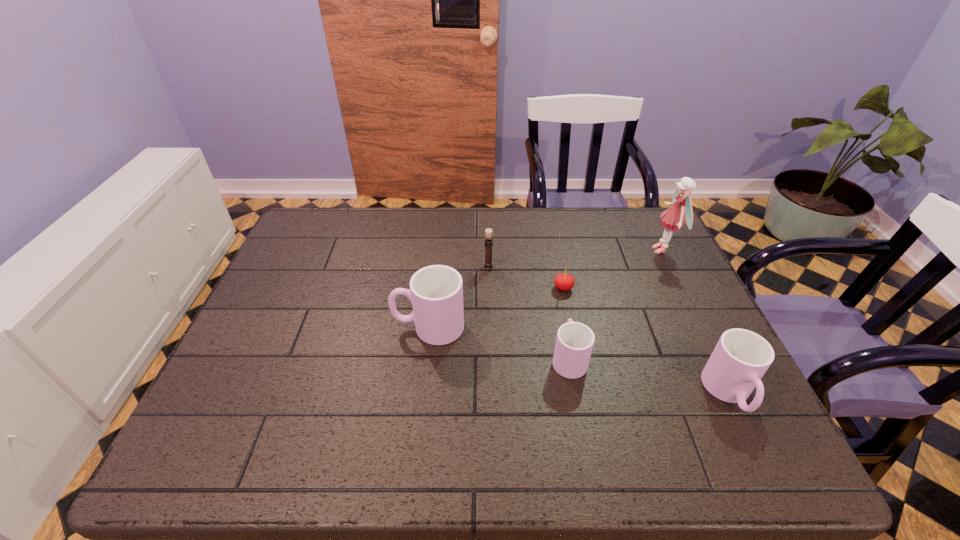
Locate an element on the screen. This screenshot has width=960, height=540. the closest cup to the rightmost cup is located at coordinates (574, 343).

Locate which cup ranks second in proximity to the second cup from left to right. Please provide its 2D coordinates. Your answer should be formatted as a tuple, i.e. [(x, y)], where the tuple contains the x and y coordinates of a point satisfying the conditions above.

[(741, 357)]

You are a GUI agent. You are given a task and a screenshot of the screen. Output one action in this format:
    pyautogui.click(x=<x>, y=<y>)
    Task: Click on the free space that satisfies the following two spatial constraints: 1. on the front-facing side of the tallest object; 2. with the handle on the side of the second shortest cup
    The image size is (960, 540).
    Given the screenshot: What is the action you would take?
    pyautogui.click(x=733, y=394)

Find the location of a particular element. The width and height of the screenshot is (960, 540). free space that satisfies the following two spatial constraints: 1. with the handle on the side of the leftmost cup; 2. on the right side of the candle holder is located at coordinates (436, 267).

The image size is (960, 540). I want to click on free space that satisfies the following two spatial constraints: 1. with the handle on the side of the leftmost cup; 2. on the right side of the candle holder, so click(436, 267).